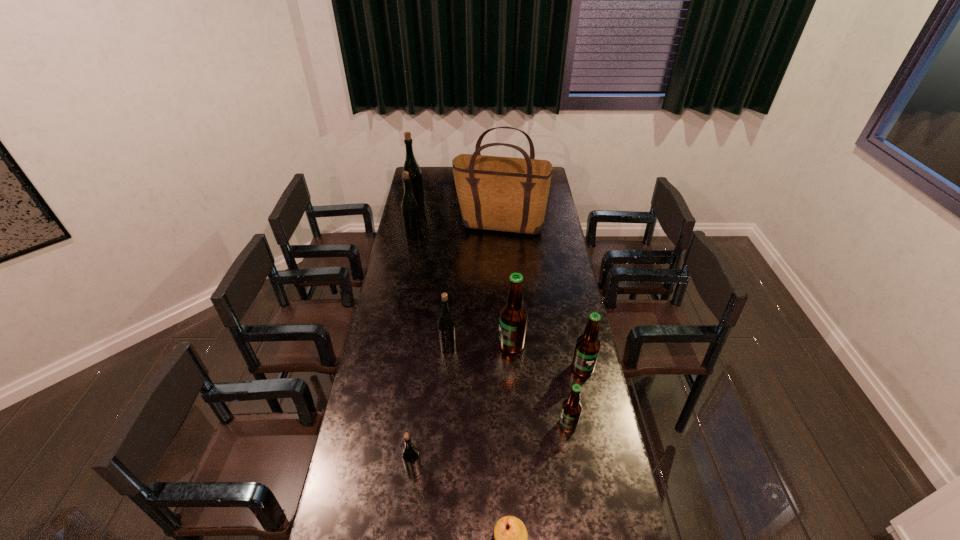
Image resolution: width=960 pixels, height=540 pixels. Find the location of `the second closest beer bottle relative to the fifth beer bottle from left to right`. the second closest beer bottle relative to the fifth beer bottle from left to right is located at coordinates (588, 345).

Where is `the fourth closest green beer bottle relative to the biggest brown beer bottle`? the fourth closest green beer bottle relative to the biggest brown beer bottle is located at coordinates (416, 182).

Choose which green beer bottle is the third nearest neighbor to the third smallest green beer bottle. Please provide its 2D coordinates. Your answer should be formatted as a tuple, i.e. [(x, y)], where the tuple contains the x and y coordinates of a point satisfying the conditions above.

[(411, 459)]

Select which brown beer bottle appears as the closest to the third nearest beer bottle. Please provide its 2D coordinates. Your answer should be formatted as a tuple, i.e. [(x, y)], where the tuple contains the x and y coordinates of a point satisfying the conditions above.

[(571, 409)]

I want to click on brown beer bottle that can be found as the third closest to the pear, so (x=513, y=316).

Identify the location of free space in the image that satisfies the following two spatial constraints: 1. on the label of the smallest brown beer bottle; 2. on the front side of the nearest beer bottle. The image size is (960, 540). (575, 470).